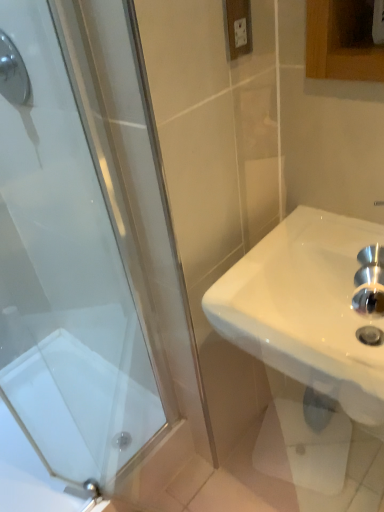
This screenshot has height=512, width=384. Find the location of `white glossy sink at right`. white glossy sink at right is located at coordinates (306, 309).

What are the coordinates of `white plastic electric outlet at upper center` in the screenshot? It's located at (238, 27).

The height and width of the screenshot is (512, 384). What are the coordinates of `white glossy sink at right` in the screenshot? It's located at (306, 309).

Considering the relative sizes of shiny chrome showerhead at upper left and white plastic electric outlet at upper center in the image provided, is shiny chrome showerhead at upper left thinner than white plastic electric outlet at upper center?

No.

Find the location of `shower behind the white plastic electric outlet at upper center`. shower behind the white plastic electric outlet at upper center is located at coordinates (13, 73).

Would you say shiny chrome showerhead at upper left is a long distance from white plastic electric outlet at upper center?

shiny chrome showerhead at upper left is actually quite close to white plastic electric outlet at upper center.

Would you say shiny chrome showerhead at upper left is outside white plastic electric outlet at upper center?

Yes, shiny chrome showerhead at upper left is not within white plastic electric outlet at upper center.

Can you confirm if white glossy bath at lower left is positioned to the left of white plastic electric outlet at upper center?

Yes.

Consider the image. What's the angular difference between white glossy bath at lower left and white plastic electric outlet at upper center's facing directions?

The facing directions of white glossy bath at lower left and white plastic electric outlet at upper center are 2.42 degrees apart.

Does point (88, 393) appear closer or farther from the camera than point (237, 27)?

Point (88, 393) is farther from the camera than point (237, 27).

Does white glossy bath at lower left lie behind white plastic electric outlet at upper center?

Yes, the depth of white glossy bath at lower left is greater than that of white plastic electric outlet at upper center.

In the image, is white glossy sink at right positioned in front of or behind white plastic electric outlet at upper center?

Clearly, white glossy sink at right is in front of white plastic electric outlet at upper center.

Is white glossy sink at right next to white plastic electric outlet at upper center?

No, white glossy sink at right is not beside white plastic electric outlet at upper center.

From a real-world perspective, does white glossy sink at right sit lower than white plastic electric outlet at upper center?

Yes, from a real-world perspective, white glossy sink at right is under white plastic electric outlet at upper center.

Considering the relative sizes of white glossy sink at right and white plastic electric outlet at upper center in the image provided, is white glossy sink at right thinner than white plastic electric outlet at upper center?

Incorrect, the width of white glossy sink at right is not less than that of white plastic electric outlet at upper center.

Is point (327, 353) less distant than point (3, 74)?

Yes, it is.

From the picture: From a real-world perspective, who is located higher, white glossy sink at right or shiny chrome showerhead at upper left?

From a 3D spatial view, shiny chrome showerhead at upper left is above.

Is white glossy sink at right taller or shorter than shiny chrome showerhead at upper left?

white glossy sink at right is shorter than shiny chrome showerhead at upper left.

Considering the positions of objects white glossy sink at right and shiny chrome showerhead at upper left in the image provided, who is more to the left, white glossy sink at right or shiny chrome showerhead at upper left?

Positioned to the left is shiny chrome showerhead at upper left.

Find the location of a particular element. This screenshot has height=512, width=384. sink that is above the white glossy bath at lower left (from the image's perspective) is located at coordinates (306, 309).

Is white glossy sink at right positioned with its back to white glossy bath at lower left?

No, white glossy bath at lower left is not at the back of white glossy sink at right.

Considering the relative positions of white glossy sink at right and white glossy bath at lower left in the image provided, is white glossy sink at right in front of white glossy bath at lower left?

Yes, white glossy sink at right is closer to the viewer.

Based on their sizes in the image, would you say shiny chrome showerhead at upper left is bigger or smaller than white glossy bath at lower left?

In the image, shiny chrome showerhead at upper left appears to be smaller than white glossy bath at lower left.

From the image's perspective, does shiny chrome showerhead at upper left appear lower than white glossy bath at lower left?

No, from the image's perspective, shiny chrome showerhead at upper left is not below white glossy bath at lower left.

What's the angular difference between shiny chrome showerhead at upper left and white glossy bath at lower left's facing directions?

The angular difference between shiny chrome showerhead at upper left and white glossy bath at lower left is 91.1 degrees.

How much distance is there between shiny chrome showerhead at upper left and white glossy bath at lower left?

shiny chrome showerhead at upper left is 36.94 inches from white glossy bath at lower left.

Considering the relative sizes of white glossy bath at lower left and white glossy sink at right in the image provided, is white glossy bath at lower left thinner than white glossy sink at right?

Incorrect, the width of white glossy bath at lower left is not less than that of white glossy sink at right.

From a real-world perspective, is white glossy bath at lower left positioned under white glossy sink at right based on gravity?

Yes, from a real-world perspective, white glossy bath at lower left is below white glossy sink at right.

Between white glossy bath at lower left and white glossy sink at right, which one appears on the right side from the viewer's perspective?

From the viewer's perspective, white glossy sink at right appears more on the right side.

Which is closer, (37, 359) or (306, 301)?

Point (306, 301)

The width and height of the screenshot is (384, 512). Find the location of `shower located underneath the white plastic electric outlet at upper center (from a real-world perspective)`. shower located underneath the white plastic electric outlet at upper center (from a real-world perspective) is located at coordinates (13, 73).

You are a GUI agent. You are given a task and a screenshot of the screen. Output one action in this format:
    pyautogui.click(x=<x>, y=<y>)
    Task: Click on the electric outlet in front of the white glossy bath at lower left
    
    Given the screenshot: What is the action you would take?
    pyautogui.click(x=238, y=27)

Looking at the image, which one is located closer to shiny chrome showerhead at upper left, white glossy sink at right or white plastic electric outlet at upper center?

white plastic electric outlet at upper center lies closer to shiny chrome showerhead at upper left than the other object.

Based on the photo, which object lies nearer to the anchor point white glossy bath at lower left, white plastic electric outlet at upper center or white glossy sink at right?

white glossy sink at right is closer to white glossy bath at lower left.

From the image, which object appears to be nearer to white plastic electric outlet at upper center, white glossy bath at lower left or shiny chrome showerhead at upper left?

The object closer to white plastic electric outlet at upper center is shiny chrome showerhead at upper left.

Which object lies further to the anchor point white glossy sink at right, white plastic electric outlet at upper center or white glossy bath at lower left?

The object further to white glossy sink at right is white glossy bath at lower left.

Considering their positions, is shiny chrome showerhead at upper left positioned further to white plastic electric outlet at upper center than white glossy bath at lower left?

white glossy bath at lower left lies further to white plastic electric outlet at upper center than the other object.

Based on their spatial positions, is white glossy sink at right or shiny chrome showerhead at upper left further from white plastic electric outlet at upper center?

shiny chrome showerhead at upper left lies further to white plastic electric outlet at upper center than the other object.

Which object lies nearer to the anchor point white glossy sink at right, shiny chrome showerhead at upper left or white plastic electric outlet at upper center?

white plastic electric outlet at upper center.

Estimate the real-world distances between objects in this image. Which object is further from white glossy bath at lower left, shiny chrome showerhead at upper left or white glossy sink at right?

shiny chrome showerhead at upper left lies further to white glossy bath at lower left than the other object.

Image resolution: width=384 pixels, height=512 pixels. In order to click on sink between white plastic electric outlet at upper center and white glossy bath at lower left in the up-down direction in this screenshot , I will do `click(306, 309)`.

Locate an element on the screen. The height and width of the screenshot is (512, 384). shower that lies between white plastic electric outlet at upper center and white glossy bath at lower left from top to bottom is located at coordinates (13, 73).

Where is `electric outlet between shiny chrome showerhead at upper left and white glossy sink at right in the horizontal direction`? The image size is (384, 512). electric outlet between shiny chrome showerhead at upper left and white glossy sink at right in the horizontal direction is located at coordinates (238, 27).

Find the location of a particular element. The width and height of the screenshot is (384, 512). sink between shiny chrome showerhead at upper left and white glossy bath at lower left in the up-down direction is located at coordinates (306, 309).